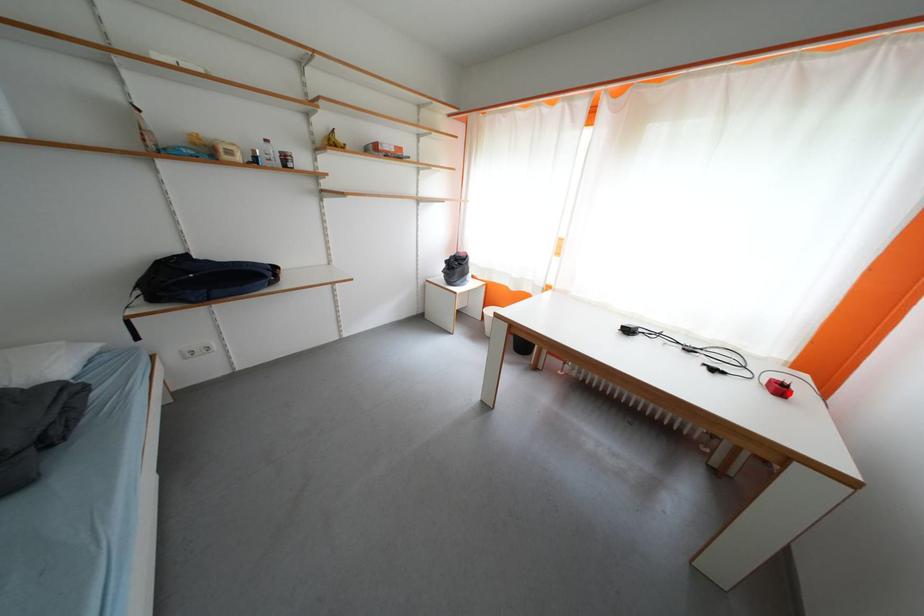
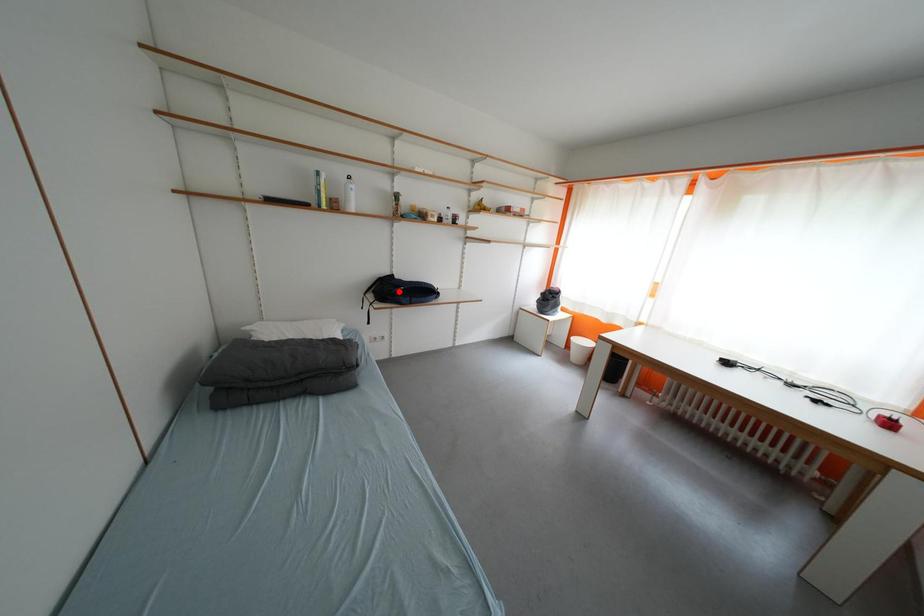
I am providing you with two images of the same scene from different viewpoints. A red point is marked on the first image and another point is marked on the second image. Does the point marked in image1 correspond to the same location as the one in image2?

No